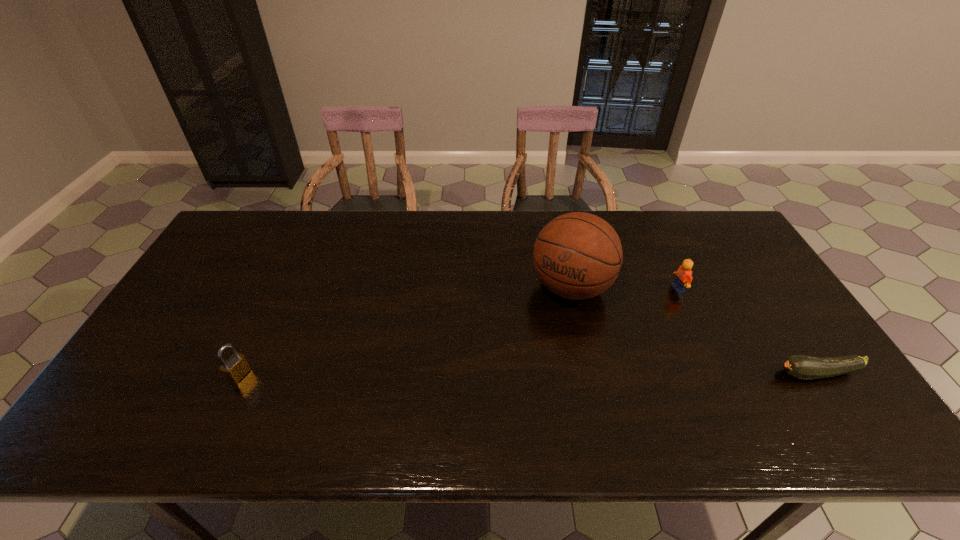
Find the location of a particular element. This screenshot has width=960, height=540. vacant region that satisfies the following two spatial constraints: 1. on the back side of the padlock; 2. at the blossom end of the shortest object is located at coordinates (240, 374).